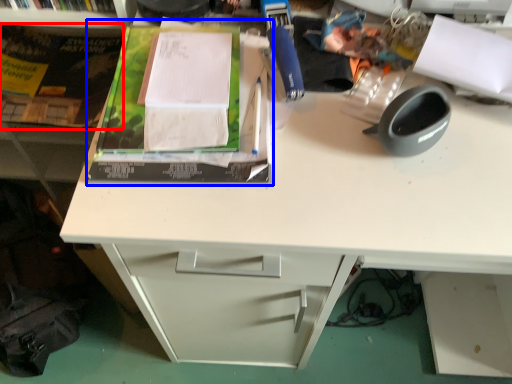
Question: Which point is closer to the camera, paperback book (highlighted by a red box) or paperback book (highlighted by a blue box)?

Choices:
 (A) paperback book
 (B) paperback book

Answer: (B)